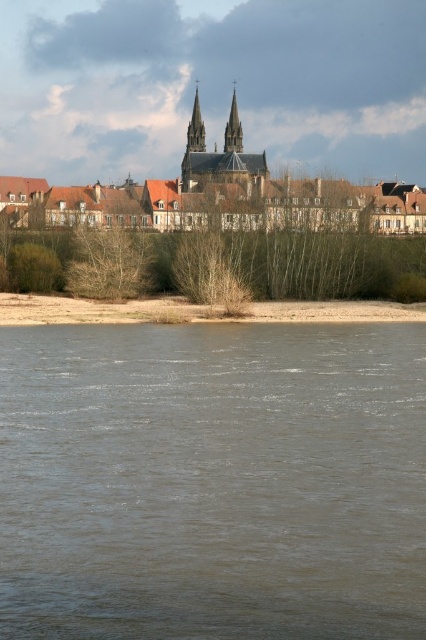
You are standing on the brown sandy shore at lower center and want to reach the brown stone buildings at upper center. Which direction should you walk to get there?

You should walk upwards towards the brown stone buildings at upper center since they are positioned over the brown sandy shore at lower center, indicating they are located in an elevated area.

You are standing at the riverside and want to reach a specific point marked at coordinates point (x=92, y=189). If you can walk 500 feet in 10 minutes, how long will it take you to reach that point?

The point (x=92, y=189) is 431.07 feet away from the camera. Since you can walk 500 feet in 10 minutes, it would take approximately 8.6 minutes to reach the point.